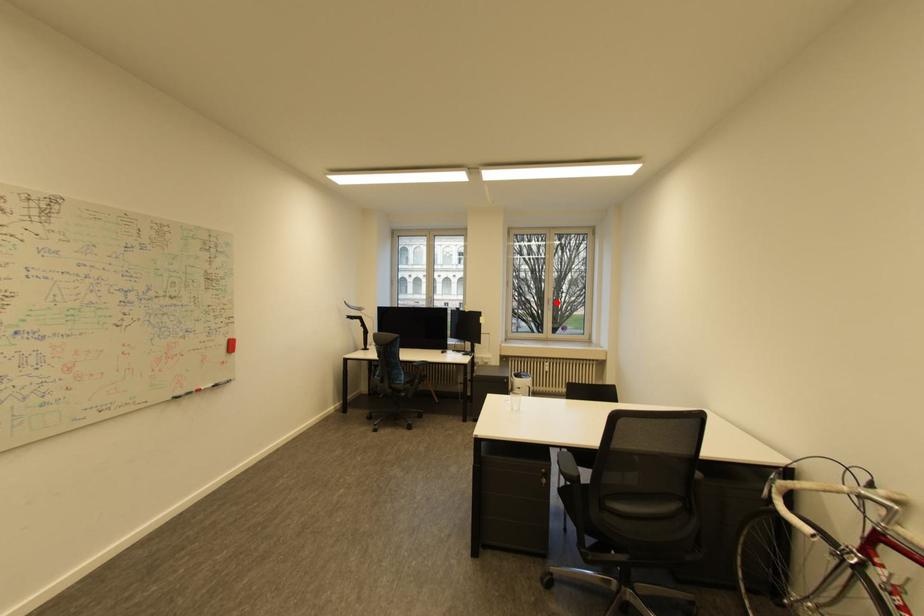
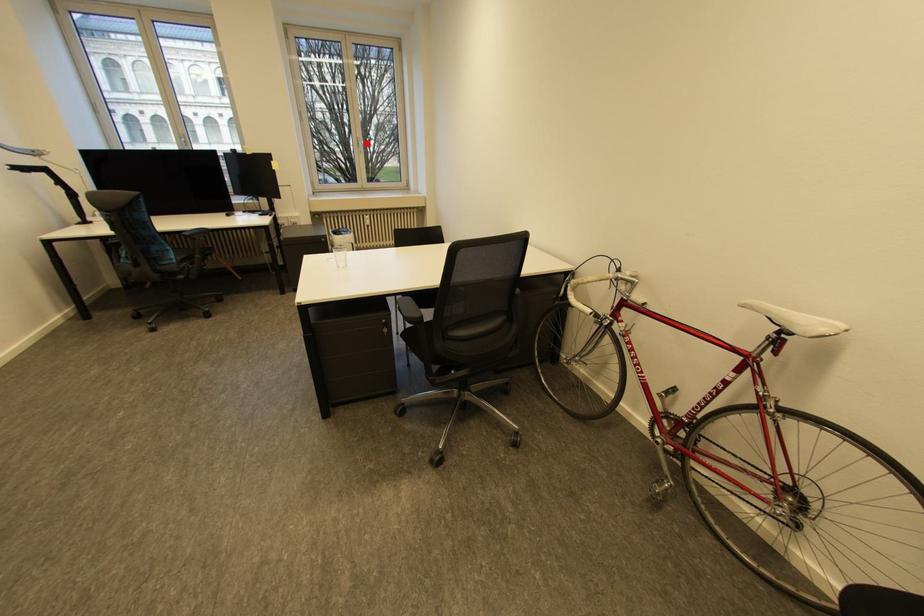
I am providing you with two images of the same scene from different viewpoints. A red point is marked on the first image and another point is marked on the second image. Are the points marked in image1 and image2 representing the same 3D position?

Yes